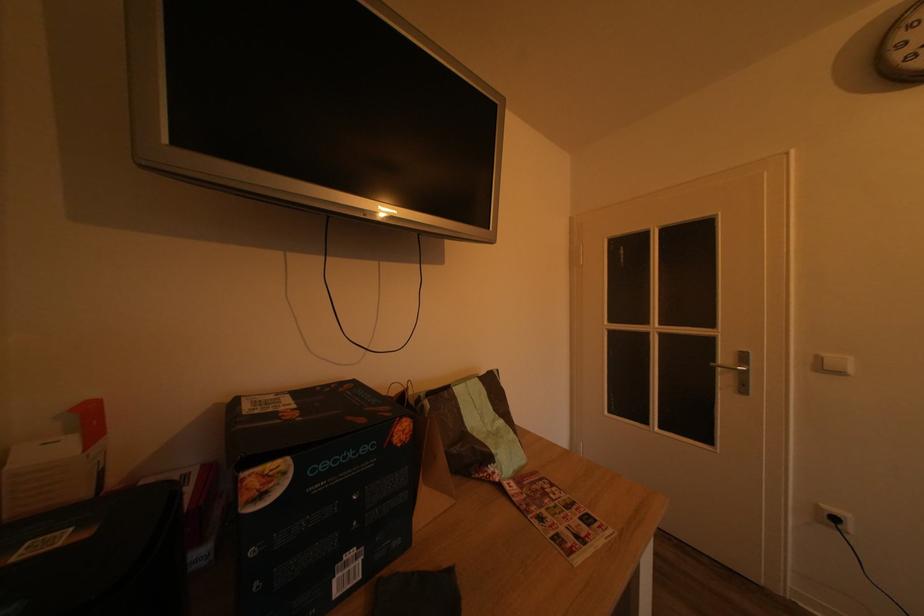
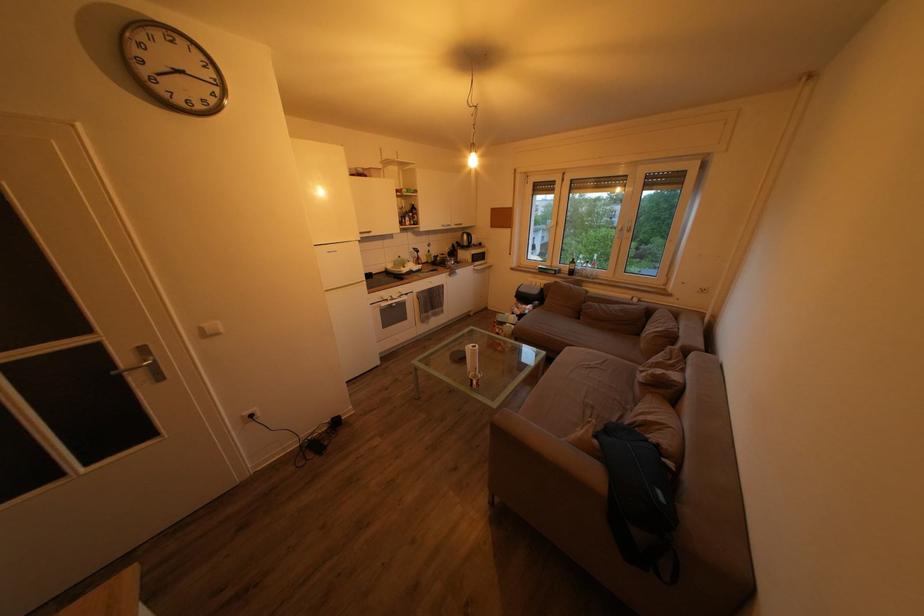
How did the camera likely rotate?

The rotation direction of the camera is right-down.